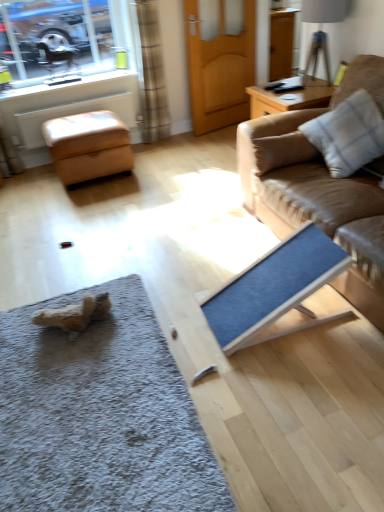
The image size is (384, 512). Find the location of `unoccupied region to the right of leather ottoman at left`. unoccupied region to the right of leather ottoman at left is located at coordinates (166, 163).